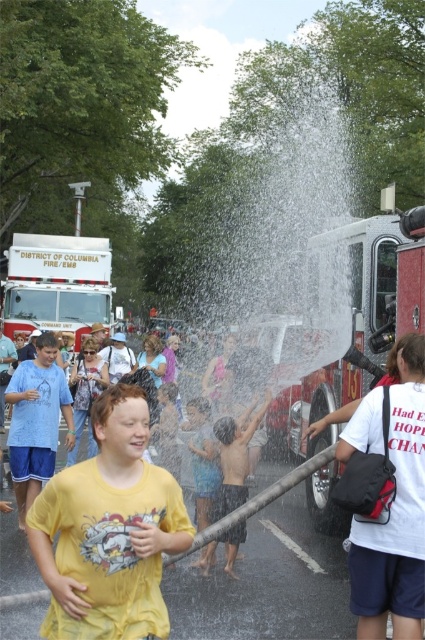
Question: From the image, what is the correct spatial relationship of yellow matte shirt at center in relation to red firetruck at right?

Choices:
 (A) above
 (B) below

Answer: (B)

Question: Is white matte fire truck at upper left further to camera compared to blue denim shorts at center?

Choices:
 (A) no
 (B) yes

Answer: (B)

Question: Which is farther from the yellow matte shirt at center?

Choices:
 (A) matte blue shorts at left
 (B) red firetruck at right
 (C) shiny blue shorts at center

Answer: (A)

Question: Which of the following is the closest to the observer?

Choices:
 (A) yellow matte shirt at center
 (B) shiny blue shorts at center
 (C) matte blue shorts at left
 (D) white matte fire truck at upper left

Answer: (A)

Question: Which of these objects is positioned farthest from the white matte fire truck at upper left?

Choices:
 (A) red firetruck at right
 (B) shiny blue shorts at center
 (C) yellow matte shirt at center
 (D) matte blue shorts at left

Answer: (C)

Question: From the image, what is the correct spatial relationship of yellow matte shirt at center in relation to matte blue shorts at left?

Choices:
 (A) above
 (B) below

Answer: (A)